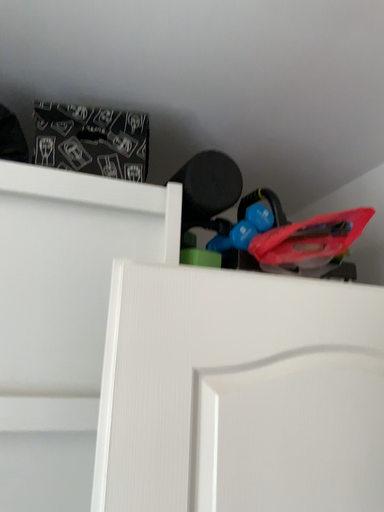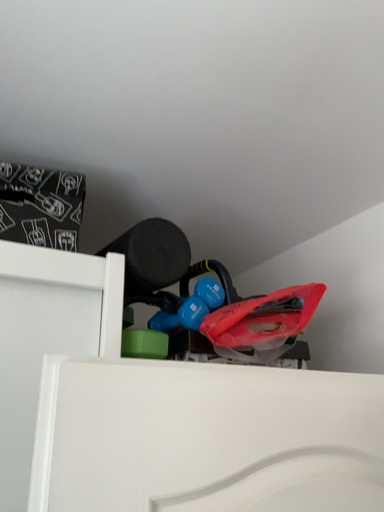
Question: How did the camera likely rotate when shooting the video?

Choices:
 (A) rotated right
 (B) rotated left

Answer: (A)